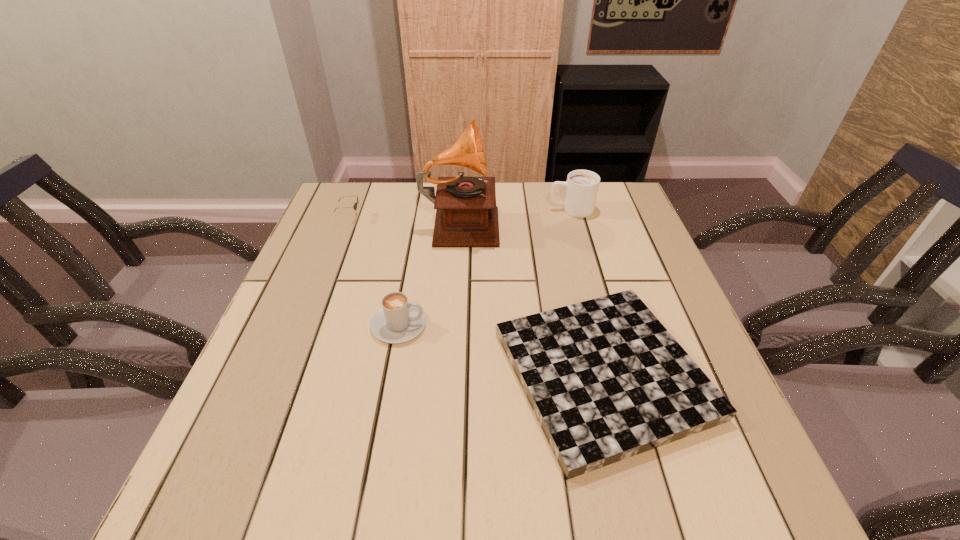
The image size is (960, 540). Identify the location of free region located on the side with the handle of the taller cappuccino. (415, 210).

Where is `vacant space located 0.110m to the right of the left cappuccino`? The width and height of the screenshot is (960, 540). vacant space located 0.110m to the right of the left cappuccino is located at coordinates (476, 325).

Identify the location of free space located in front of the lenses of the sunglasses. The image size is (960, 540). [389, 218].

Identify the location of free region located 0.180m on the back of the checkerboard. The width and height of the screenshot is (960, 540). click(x=573, y=252).

Identify the location of phonograph record present at the far edge. (466, 213).

Identify the location of cappuccino positioned at the far edge. (582, 186).

Where is `sunglasses that is at the far edge`? sunglasses that is at the far edge is located at coordinates (355, 205).

Find the location of a particular element. object that is at the near edge is located at coordinates [x=606, y=380].

Locate an element on the screen. Image resolution: width=960 pixels, height=540 pixels. object that is positioned at the left edge is located at coordinates (355, 205).

The image size is (960, 540). Identify the location of cappuccino positioned at the right edge. [x=582, y=186].